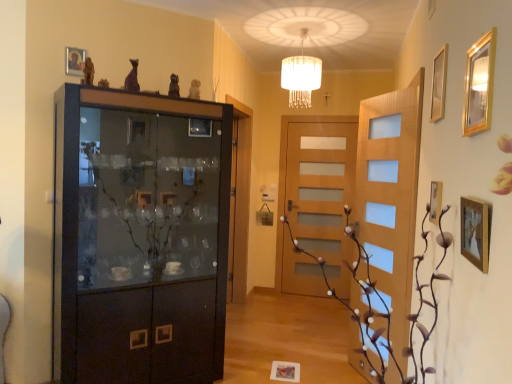
Question: Does brown textured plant at center touch wooden picture frame at lower center, marked as the fifth picture frame in a top-to-bottom arrangement?

Choices:
 (A) no
 (B) yes

Answer: (A)

Question: Is brown textured plant at center located outside wooden picture frame at lower center, the second picture frame when ordered from left to right?

Choices:
 (A) yes
 (B) no

Answer: (A)

Question: Is brown textured plant at center to the right of wooden picture frame at lower center, which is the 1th picture frame from back to front, from the viewer's perspective?

Choices:
 (A) yes
 (B) no

Answer: (A)

Question: Is brown textured plant at center behind wooden picture frame at lower center, marked as the fifth picture frame in a top-to-bottom arrangement?

Choices:
 (A) yes
 (B) no

Answer: (B)

Question: Does brown textured plant at center have a lesser height compared to wooden picture frame at lower center, the first picture frame in the bottom-to-top sequence?

Choices:
 (A) yes
 (B) no

Answer: (B)

Question: Is the position of brown textured plant at center less distant than that of wooden picture frame at lower center, the first picture frame in the bottom-to-top sequence?

Choices:
 (A) yes
 (B) no

Answer: (A)

Question: Does gold metallic picture frame at upper right, the third picture frame from the front, have a greater height compared to matte black cabinet at left?

Choices:
 (A) no
 (B) yes

Answer: (A)

Question: From a real-world perspective, is gold metallic picture frame at upper right, acting as the fifth picture frame starting from the left, beneath matte black cabinet at left?

Choices:
 (A) yes
 (B) no

Answer: (B)

Question: Does gold metallic picture frame at upper right, acting as the fifth picture frame starting from the left, have a greater width compared to matte black cabinet at left?

Choices:
 (A) no
 (B) yes

Answer: (A)

Question: Does gold metallic picture frame at upper right, acting as the fifth picture frame starting from the left, come behind matte black cabinet at left?

Choices:
 (A) no
 (B) yes

Answer: (A)

Question: Is gold metallic picture frame at upper right, positioned as the 2th picture frame in top-to-bottom order, bigger than matte black cabinet at left?

Choices:
 (A) yes
 (B) no

Answer: (B)

Question: From a real-world perspective, is gold metallic picture frame at upper right, the 3th picture frame viewed from the back, positioned over matte black cabinet at left based on gravity?

Choices:
 (A) yes
 (B) no

Answer: (A)

Question: Is gold metallic picture frame at upper right, acting as the fifth picture frame starting from the left, placed right next to wooden picture frame at lower center, acting as the fourth picture frame starting from the right?

Choices:
 (A) no
 (B) yes

Answer: (A)